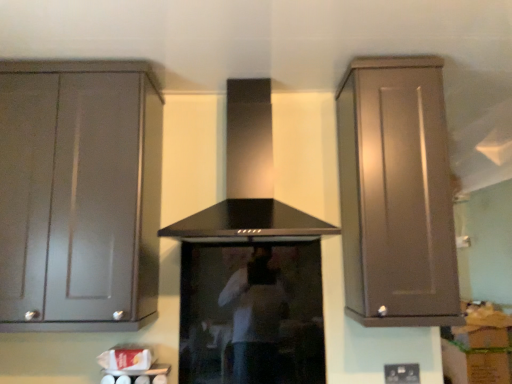
You are a GUI agent. You are given a task and a screenshot of the screen. Output one action in this format:
    pyautogui.click(x=<x>, y=<y>)
    Task: Click on the black glass stove at center
    
    Given the screenshot: What is the action you would take?
    pyautogui.click(x=251, y=314)

Which is nearer, (120, 143) or (230, 114)?

The point (120, 143) is closer.

Between matte gray cabinet at left, the 2th cabinetry viewed from the right, and black matte vent at center, which one has larger size?

matte gray cabinet at left, the 2th cabinetry viewed from the right.

Would you say matte gray cabinet at left, the 2th cabinetry viewed from the right, is inside or outside black matte vent at center?

matte gray cabinet at left, the 2th cabinetry viewed from the right, is outside black matte vent at center.

Is there a large distance between matte gray cabinet at left, arranged as the first cabinetry when viewed from the left, and black matte vent at center?

No, matte gray cabinet at left, arranged as the first cabinetry when viewed from the left, is not far from black matte vent at center.

Is matte brown cabinet at right, marked as the 1th cabinetry in a right-to-left arrangement, not near matte gray cabinet at left, the 2th cabinetry viewed from the right?

matte brown cabinet at right, marked as the 1th cabinetry in a right-to-left arrangement, is near matte gray cabinet at left, the 2th cabinetry viewed from the right, not far away.

Is matte brown cabinet at right, marked as the 1th cabinetry in a right-to-left arrangement, aimed at matte gray cabinet at left, arranged as the first cabinetry when viewed from the left?

No, matte brown cabinet at right, marked as the 1th cabinetry in a right-to-left arrangement, is not oriented towards matte gray cabinet at left, arranged as the first cabinetry when viewed from the left.

Between matte brown cabinet at right, which is counted as the 2th cabinetry, starting from the left, and matte gray cabinet at left, the 2th cabinetry viewed from the right, which one has less height?

With less height is matte gray cabinet at left, the 2th cabinetry viewed from the right.

Is matte brown cabinet at right, marked as the 1th cabinetry in a right-to-left arrangement, positioned with its back to black glass stove at center?

That's not correct — matte brown cabinet at right, marked as the 1th cabinetry in a right-to-left arrangement, is not looking away from black glass stove at center.

Does matte brown cabinet at right, marked as the 1th cabinetry in a right-to-left arrangement, have a smaller size compared to black glass stove at center?

Incorrect, matte brown cabinet at right, marked as the 1th cabinetry in a right-to-left arrangement, is not smaller in size than black glass stove at center.

From a real-world perspective, does matte brown cabinet at right, marked as the 1th cabinetry in a right-to-left arrangement, stand above black glass stove at center?

Indeed, from a real-world perspective, matte brown cabinet at right, marked as the 1th cabinetry in a right-to-left arrangement, stands above black glass stove at center.

Is matte brown cabinet at right, marked as the 1th cabinetry in a right-to-left arrangement, not inside black glass stove at center?

That's correct, matte brown cabinet at right, marked as the 1th cabinetry in a right-to-left arrangement, is outside of black glass stove at center.

From the image's perspective, would you say black plastic electric outlet at lower center is positioned over matte brown cabinet at right, marked as the 1th cabinetry in a right-to-left arrangement?

No, from the image's perspective, black plastic electric outlet at lower center is not on top of matte brown cabinet at right, marked as the 1th cabinetry in a right-to-left arrangement.

How distant is black plastic electric outlet at lower center from matte brown cabinet at right, marked as the 1th cabinetry in a right-to-left arrangement?

black plastic electric outlet at lower center and matte brown cabinet at right, marked as the 1th cabinetry in a right-to-left arrangement, are 28.97 inches apart from each other.

Consider the image. Is black plastic electric outlet at lower center taller or shorter than matte brown cabinet at right, marked as the 1th cabinetry in a right-to-left arrangement?

In the image, black plastic electric outlet at lower center appears to be shorter than matte brown cabinet at right, marked as the 1th cabinetry in a right-to-left arrangement.

From a real-world perspective, between black plastic electric outlet at lower center and matte brown cabinet at right, marked as the 1th cabinetry in a right-to-left arrangement, who is vertically lower?

In real-world perspective, black plastic electric outlet at lower center is lower.

Is black plastic electric outlet at lower center oriented towards matte gray cabinet at left, the 2th cabinetry viewed from the right?

No, black plastic electric outlet at lower center does not turn towards matte gray cabinet at left, the 2th cabinetry viewed from the right.

Considering the relative positions of black plastic electric outlet at lower center and matte gray cabinet at left, the 2th cabinetry viewed from the right, in the image provided, is black plastic electric outlet at lower center in front of matte gray cabinet at left, the 2th cabinetry viewed from the right,?

No, black plastic electric outlet at lower center is further to the viewer.

In order to click on electric outlet lying below the matte gray cabinet at left, arranged as the first cabinetry when viewed from the left (from the image's perspective) in this screenshot , I will do `click(402, 373)`.

Is black plastic electric outlet at lower center inside or outside of matte gray cabinet at left, the 2th cabinetry viewed from the right?

black plastic electric outlet at lower center lies outside matte gray cabinet at left, the 2th cabinetry viewed from the right.

Is black matte vent at center touching black glass stove at center?

black matte vent at center is not next to black glass stove at center, and they're not touching.

Measure the distance between black matte vent at center and black glass stove at center.

black matte vent at center and black glass stove at center are 37.95 centimeters apart from each other.

In terms of height, does black matte vent at center look taller or shorter compared to black glass stove at center?

In the image, black matte vent at center appears to be taller than black glass stove at center.

From a real-world perspective, is black matte vent at center above or below black glass stove at center?

Clearly, from a real-world perspective, black matte vent at center is above black glass stove at center.

From the image's perspective, which one is positioned lower, black plastic electric outlet at lower center or black matte vent at center?

black plastic electric outlet at lower center.

Which object is further away from the camera, black plastic electric outlet at lower center or black matte vent at center?

black plastic electric outlet at lower center.

Considering the relative sizes of black plastic electric outlet at lower center and black matte vent at center in the image provided, is black plastic electric outlet at lower center bigger than black matte vent at center?

Incorrect, black plastic electric outlet at lower center is not larger than black matte vent at center.

Does black plastic electric outlet at lower center have a lesser width compared to black matte vent at center?

Yes, black plastic electric outlet at lower center is thinner than black matte vent at center.

This screenshot has width=512, height=384. What are the coordinates of `the 1st cabinetry behind the black matte vent at center` in the screenshot? It's located at (79, 195).

This screenshot has height=384, width=512. Find the location of `cabinetry on the right of matte gray cabinet at left, the 2th cabinetry viewed from the right`. cabinetry on the right of matte gray cabinet at left, the 2th cabinetry viewed from the right is located at coordinates (396, 194).

Looking at the image, which one is located further to black plastic electric outlet at lower center, matte gray cabinet at left, the 2th cabinetry viewed from the right, or black matte vent at center?

Based on the image, matte gray cabinet at left, the 2th cabinetry viewed from the right, appears to be further to black plastic electric outlet at lower center.

From the image, which object appears to be farther from black matte vent at center, black glass stove at center or black plastic electric outlet at lower center?

black plastic electric outlet at lower center.

From the image, which object appears to be farther from black glass stove at center, matte gray cabinet at left, arranged as the first cabinetry when viewed from the left, or matte brown cabinet at right, which is counted as the 2th cabinetry, starting from the left?

matte gray cabinet at left, arranged as the first cabinetry when viewed from the left.

Considering their positions, is black plastic electric outlet at lower center positioned further to matte gray cabinet at left, arranged as the first cabinetry when viewed from the left, than matte brown cabinet at right, marked as the 1th cabinetry in a right-to-left arrangement?

Among the two, black plastic electric outlet at lower center is located further to matte gray cabinet at left, arranged as the first cabinetry when viewed from the left.

From the image, which object appears to be farther from black glass stove at center, matte brown cabinet at right, marked as the 1th cabinetry in a right-to-left arrangement, or matte gray cabinet at left, arranged as the first cabinetry when viewed from the left?

matte gray cabinet at left, arranged as the first cabinetry when viewed from the left.

Based on their spatial positions, is black plastic electric outlet at lower center or black glass stove at center further from black matte vent at center?

black plastic electric outlet at lower center lies further to black matte vent at center than the other object.

When comparing their distances from black glass stove at center, does black plastic electric outlet at lower center or matte gray cabinet at left, the 2th cabinetry viewed from the right, seem further?

black plastic electric outlet at lower center lies further to black glass stove at center than the other object.

From the image, which object appears to be farther from black glass stove at center, matte brown cabinet at right, which is counted as the 2th cabinetry, starting from the left, or black matte vent at center?

Among the two, matte brown cabinet at right, which is counted as the 2th cabinetry, starting from the left, is located further to black glass stove at center.

Find the location of a particular element. appliance located between matte gray cabinet at left, arranged as the first cabinetry when viewed from the left, and black plastic electric outlet at lower center in the left-right direction is located at coordinates (251, 314).

Find the location of a particular element. The image size is (512, 384). vent situated between matte gray cabinet at left, the 2th cabinetry viewed from the right, and matte brown cabinet at right, which is counted as the 2th cabinetry, starting from the left, from left to right is located at coordinates (249, 178).

This screenshot has width=512, height=384. Find the location of `appliance between matte gray cabinet at left, the 2th cabinetry viewed from the right, and matte brown cabinet at right, which is counted as the 2th cabinetry, starting from the left`. appliance between matte gray cabinet at left, the 2th cabinetry viewed from the right, and matte brown cabinet at right, which is counted as the 2th cabinetry, starting from the left is located at coordinates (251, 314).

The image size is (512, 384). I want to click on vent between matte gray cabinet at left, the 2th cabinetry viewed from the right, and black plastic electric outlet at lower center, in the horizontal direction, so pyautogui.click(x=249, y=178).